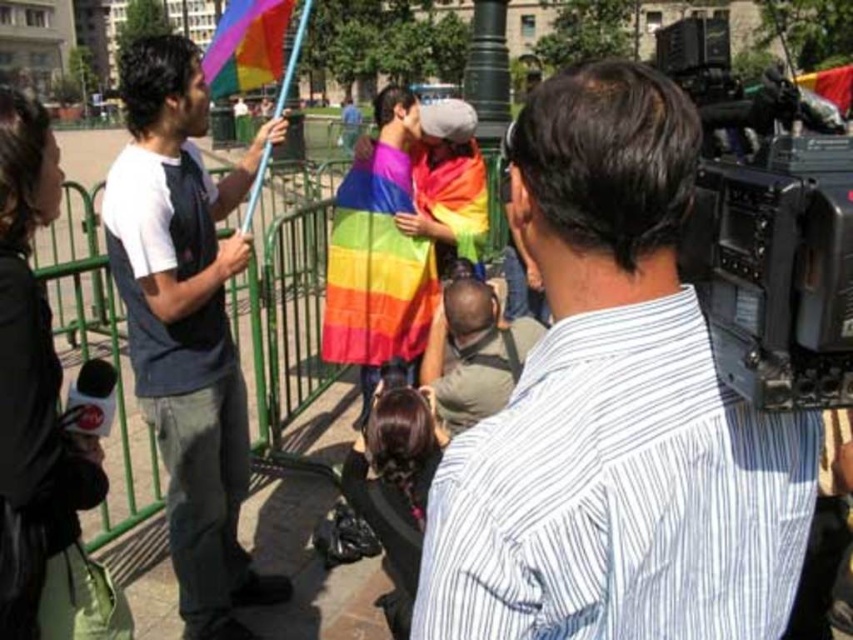
Can you confirm if rainbow fabric flag at center is positioned above dark brown leather jacket at center?

Correct, rainbow fabric flag at center is located above dark brown leather jacket at center.

Locate an element on the screen. rainbow fabric flag at center is located at coordinates 376,266.

Is black plastic video camera at right positioned in front of rainbow fabric flag at upper center?

Yes, it is.

Which is behind, point (770, 132) or point (225, 86)?

The point (225, 86) is behind.

Locate an element on the screen. black plastic video camera at right is located at coordinates (766, 227).

Find the location of a particular element. The height and width of the screenshot is (640, 853). white striped shirt at upper right is located at coordinates (614, 410).

Which is below, white striped shirt at upper right or black plastic video camera at right?

white striped shirt at upper right

Between point (576, 419) and point (723, 76), which one is positioned behind?

Point (723, 76)

Locate an element on the screen. The width and height of the screenshot is (853, 640). white striped shirt at upper right is located at coordinates (614, 410).